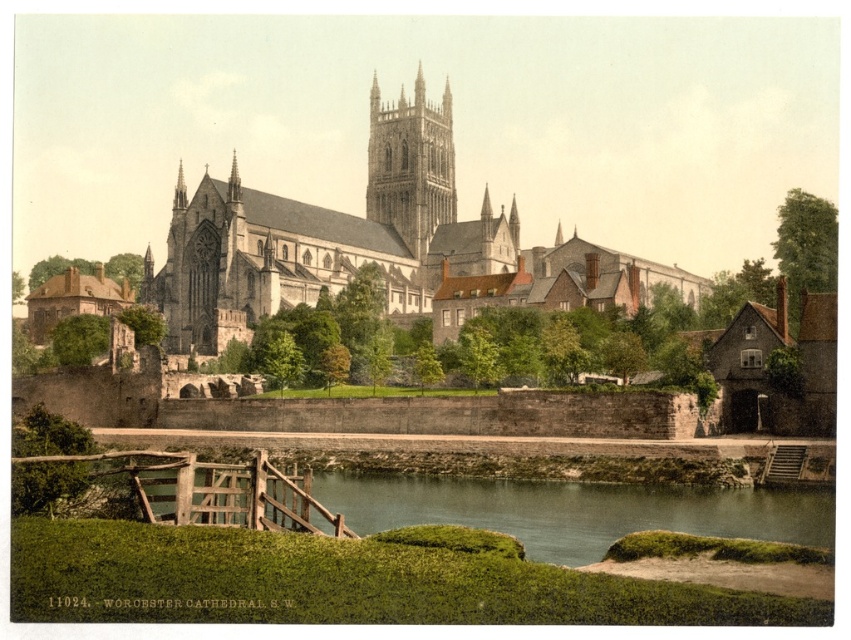
Based on the scene description, where is the white stone church at center located in the image?

The white stone church at center is located at point (372,243).

You are standing on the wooden bridge looking towards the cathedral. You notice the green grassy bank at lower center and the brown stone tower at center. Which object is closer to you as you stand on the bridge?

The green grassy bank at lower center is closer to you since it is positioned in front of the brown stone tower at center from your vantage point on the bridge.